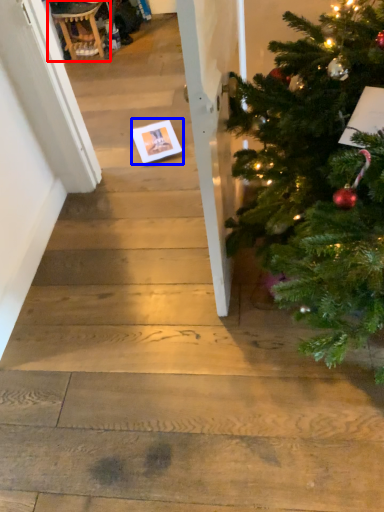
Question: Which point is closer to the camera, rocking chair (highlighted by a red box) or christmas card (highlighted by a blue box)?

Choices:
 (A) rocking chair
 (B) christmas card

Answer: (B)